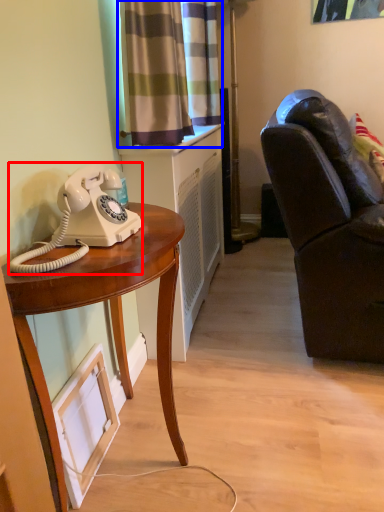
Question: Which of the following is the closest to the observer, corded phone (highlighted by a red box) or curtain (highlighted by a blue box)?

Choices:
 (A) corded phone
 (B) curtain

Answer: (A)